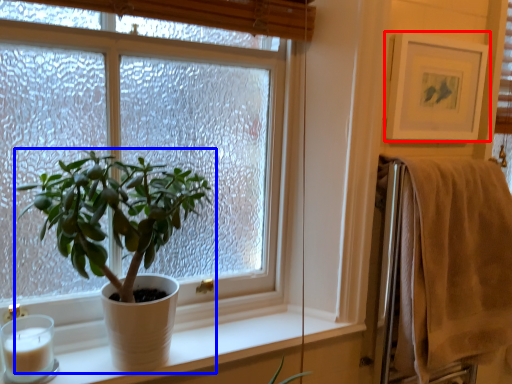
Question: Among these objects, which one is nearest to the camera, picture frame (highlighted by a red box) or houseplant (highlighted by a blue box)?

Choices:
 (A) picture frame
 (B) houseplant

Answer: (B)